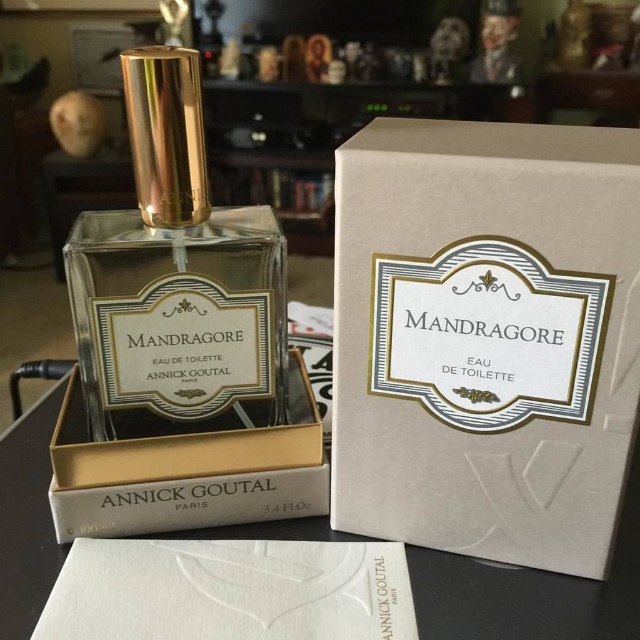
Question: Which of the following is the closest to the observer?

Choices:
 (A) white cardboard box at center
 (B) matte gold box at center

Answer: (A)

Question: Can you confirm if white cardboard box at center is smaller than matte gold box at center?

Choices:
 (A) yes
 (B) no

Answer: (B)

Question: Is white cardboard box at center further to camera compared to matte gold box at center?

Choices:
 (A) yes
 (B) no

Answer: (B)

Question: Is the position of white cardboard box at center less distant than that of matte gold box at center?

Choices:
 (A) yes
 (B) no

Answer: (A)

Question: Estimate the real-world distances between objects in this image. Which object is farther from the matte glass perfume at center?

Choices:
 (A) matte gold box at center
 (B) white cardboard box at center

Answer: (B)

Question: Which is farther from the white cardboard box at center?

Choices:
 (A) matte gold box at center
 (B) matte glass perfume at center

Answer: (A)